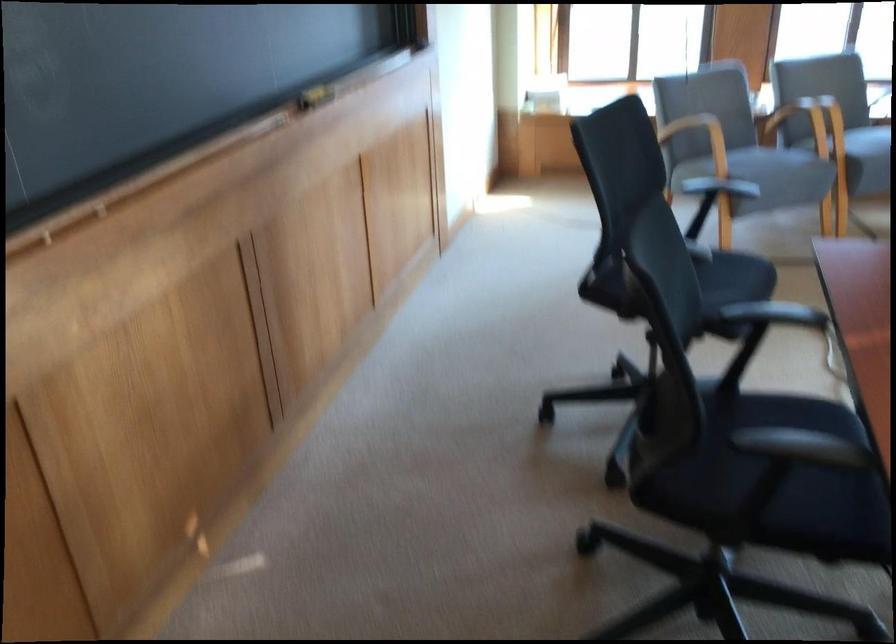
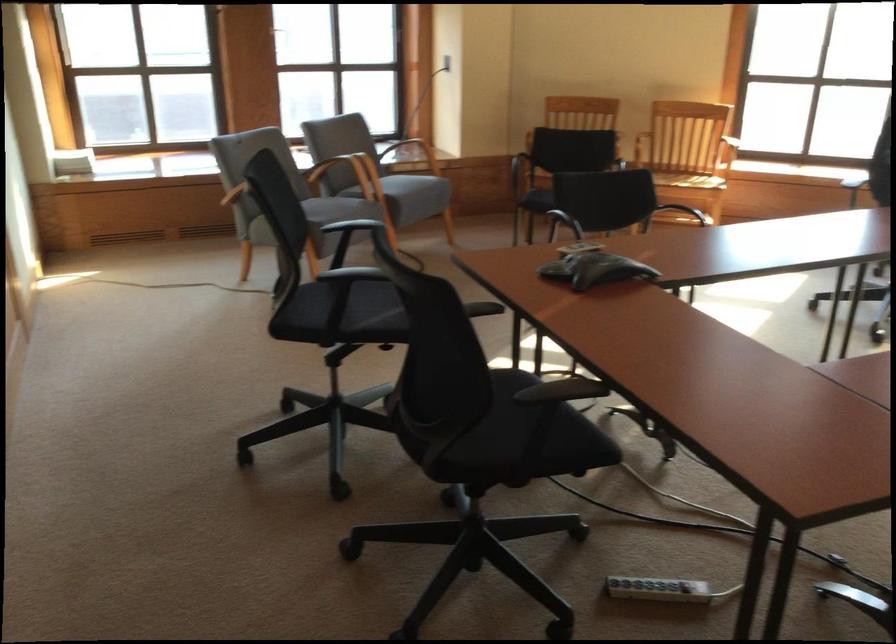
Where in the second image is the point corresponding to (x=805, y=114) from the first image?

(342, 172)